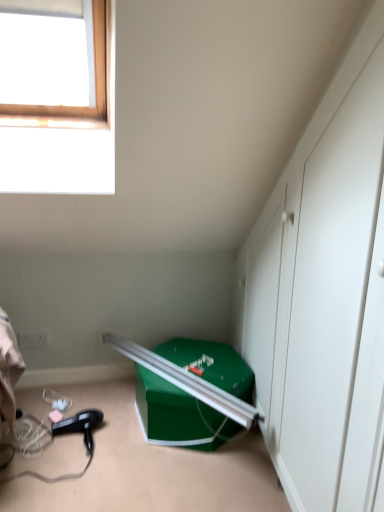
Find the location of a particular element. vacant location behind black plastic hair dryer at lower left is located at coordinates (111, 408).